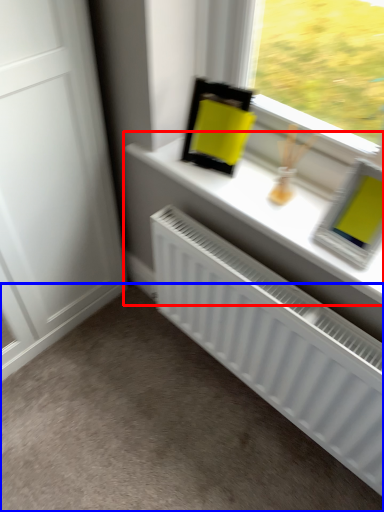
Question: Which point is further to the camera, window sill (highlighted by a red box) or plain (highlighted by a blue box)?

Choices:
 (A) window sill
 (B) plain

Answer: (A)